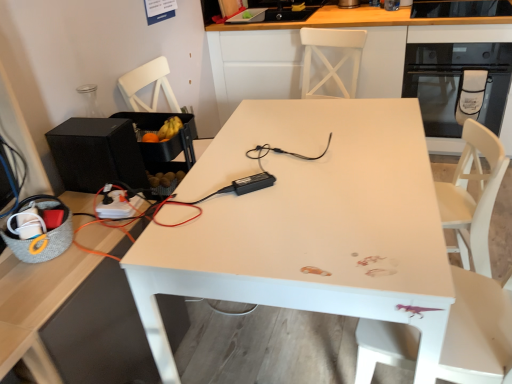
Question: Looking at the image, does black matte speaker at left seem bigger or smaller compared to white glossy cabinet at upper center?

Choices:
 (A) big
 (B) small

Answer: (B)

Question: Is point (142, 172) closer or farther from the camera than point (337, 19)?

Choices:
 (A) closer
 (B) farther

Answer: (A)

Question: Which object is positioned closest to the black matte speaker at left?

Choices:
 (A) white matte table at center
 (B) white glossy cabinet at upper center
 (C) black glass oven at upper right

Answer: (A)

Question: Which is farther from the black glass oven at upper right?

Choices:
 (A) white glossy cabinet at upper center
 (B) white matte table at center
 (C) black matte speaker at left

Answer: (C)